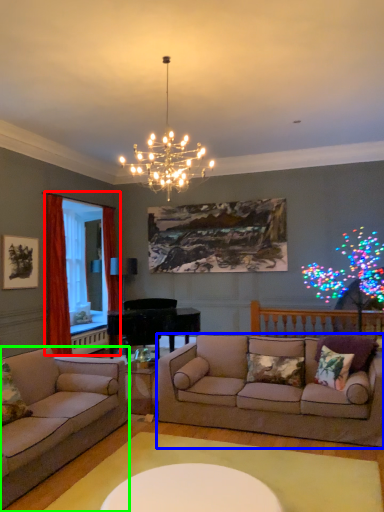
Question: Which object is the farthest from window screen (highlighted by a red box)? Choose among these: studio couch (highlighted by a blue box) or studio couch (highlighted by a green box).

Choices:
 (A) studio couch
 (B) studio couch

Answer: (A)